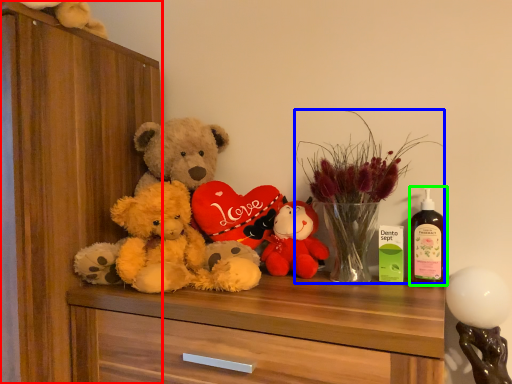
Question: Considering the real-world distances, which object is farthest from dresser (highlighted by a red box)? floral arrangement (highlighted by a blue box) or bottle (highlighted by a green box)?

Choices:
 (A) floral arrangement
 (B) bottle

Answer: (B)